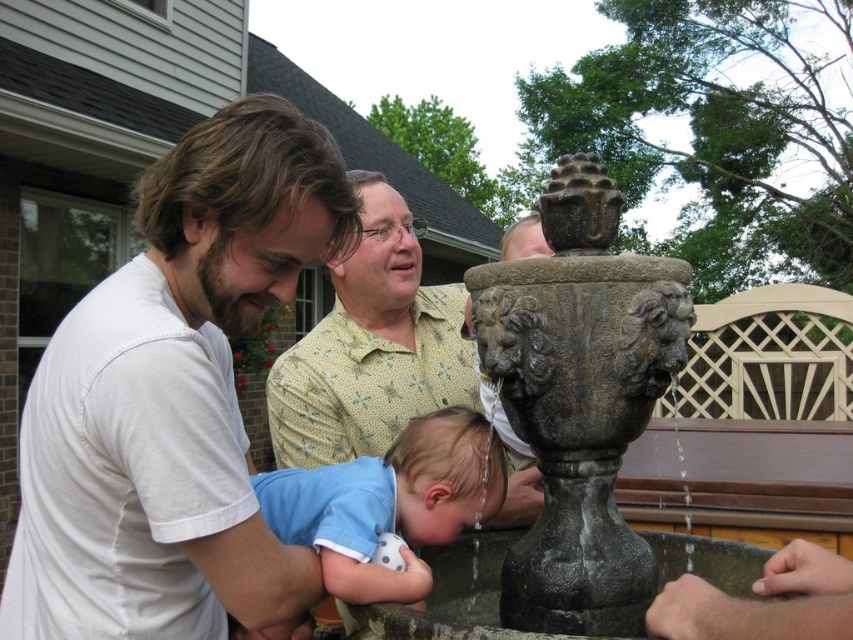
In the scene shown: You are a photographer trying to capture the stone fountain at center and the smooth gray hand at lower right in the same frame. Based on their positions, which object should you position closer to the left side of your camera viewfinder?

The stone fountain at center is to the left of the smooth gray hand at lower right, so you should position the stone fountain at center closer to the left side of your camera viewfinder.